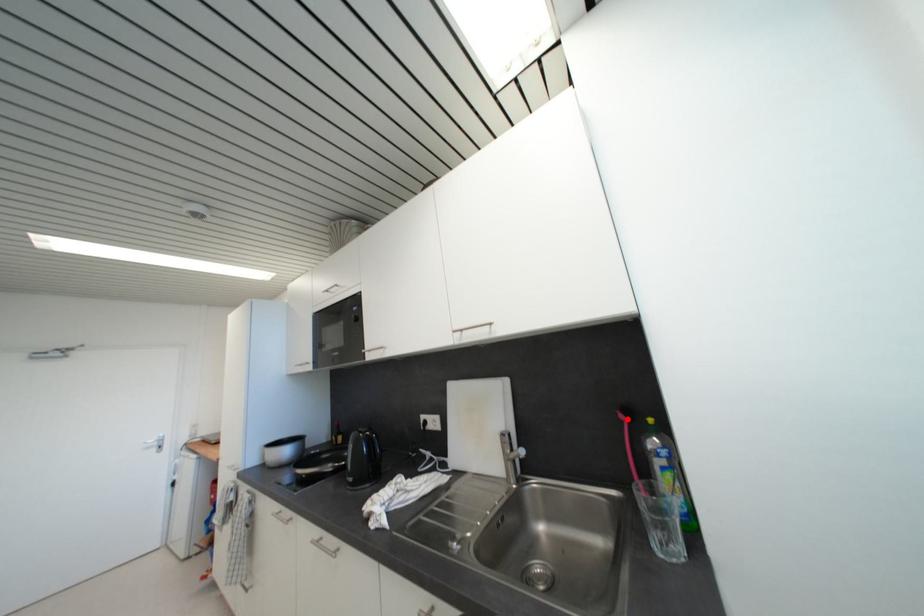
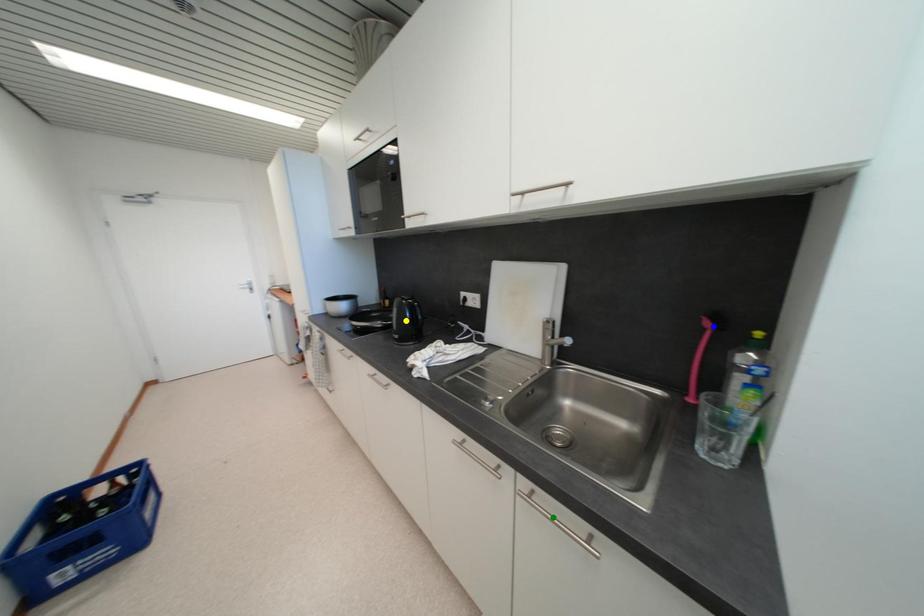
Question: I am providing you with two images of the same scene from different viewpoints. A red point is marked on the first image. You are given multiple points on the second image. Can you choose the point in image 2 that corresponds to the point in image 1?

Choices:
 (A) blue point
 (B) yellow point
 (C) green point

Answer: (A)